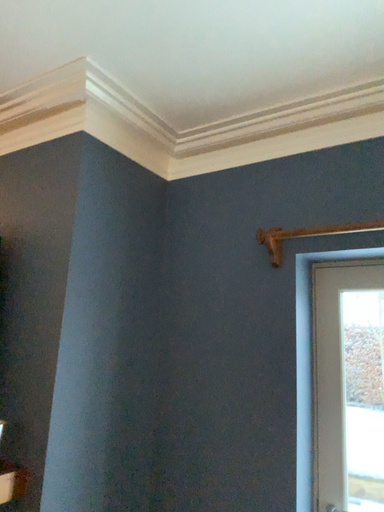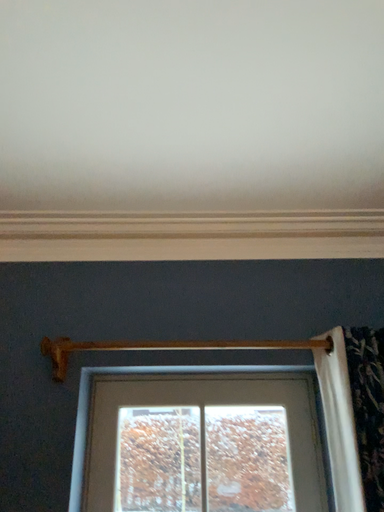
Question: How did the camera likely rotate when shooting the video?

Choices:
 (A) rotated right
 (B) rotated left

Answer: (A)